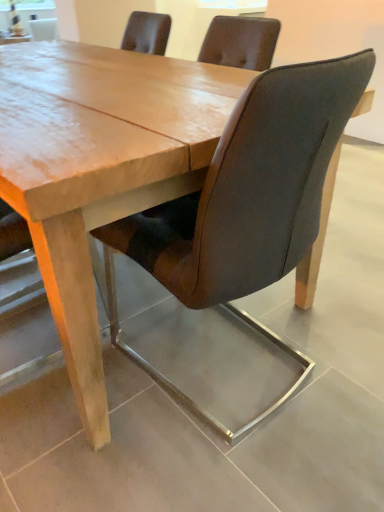
Where is `brown leather chair at center`? brown leather chair at center is located at coordinates [x=240, y=243].

What is the approximate height of brown leather chair at center?

It is 93.58 centimeters.

The width and height of the screenshot is (384, 512). What do you see at coordinates (240, 243) in the screenshot?
I see `brown leather chair at center` at bounding box center [240, 243].

Find the location of a particular element. The width and height of the screenshot is (384, 512). brown leather chair at center is located at coordinates (240, 243).